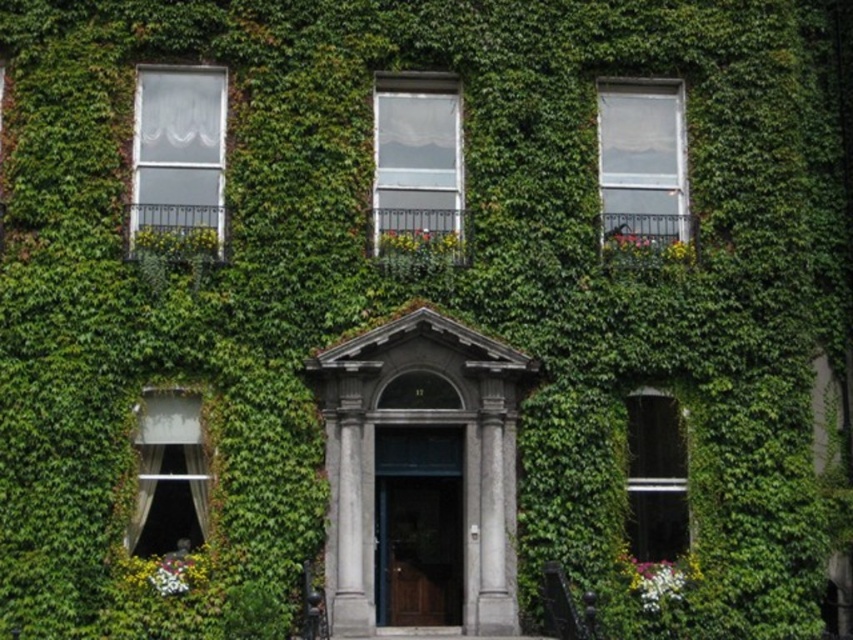
Who is positioned more to the left, white sheer curtain at lower left or clear glass window at right?

Positioned to the left is white sheer curtain at lower left.

Is white sheer curtain at lower left thinner than clear glass window at right?

Incorrect, white sheer curtain at lower left's width is not less than clear glass window at right's.

Locate an element on the screen. The width and height of the screenshot is (853, 640). white sheer curtain at lower left is located at coordinates (169, 474).

The height and width of the screenshot is (640, 853). Find the location of `white sheer curtain at lower left`. white sheer curtain at lower left is located at coordinates (169, 474).

Who is shorter, clear glass window at center or clear glass window at upper right?

Standing shorter between the two is clear glass window at upper right.

Does point (384, 131) come behind point (680, 196)?

No.

This screenshot has height=640, width=853. What do you see at coordinates (416, 163) in the screenshot?
I see `clear glass window at center` at bounding box center [416, 163].

I want to click on clear glass window at center, so click(416, 163).

Is white sheer curtain at upper left bigger than white sheer curtain at lower left?

Incorrect, white sheer curtain at upper left is not larger than white sheer curtain at lower left.

Between white sheer curtain at upper left and white sheer curtain at lower left, which one has more height?

With more height is white sheer curtain at lower left.

Is point (212, 220) positioned behind point (167, 445)?

Yes, it is.

Where is `white sheer curtain at upper left`? Image resolution: width=853 pixels, height=640 pixels. white sheer curtain at upper left is located at coordinates (178, 156).